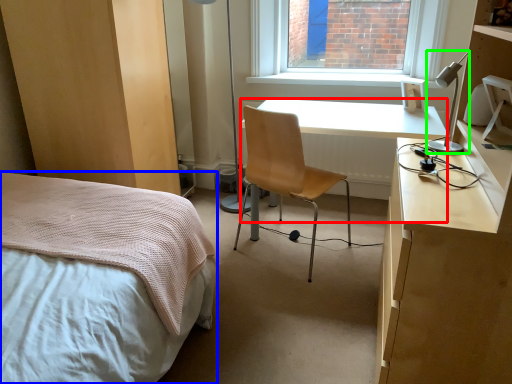
Question: Based on their relative distances, which object is nearer to desk (highlighted by a red box)? Choose from bed (highlighted by a blue box) and lamp (highlighted by a green box).

Choices:
 (A) bed
 (B) lamp

Answer: (B)